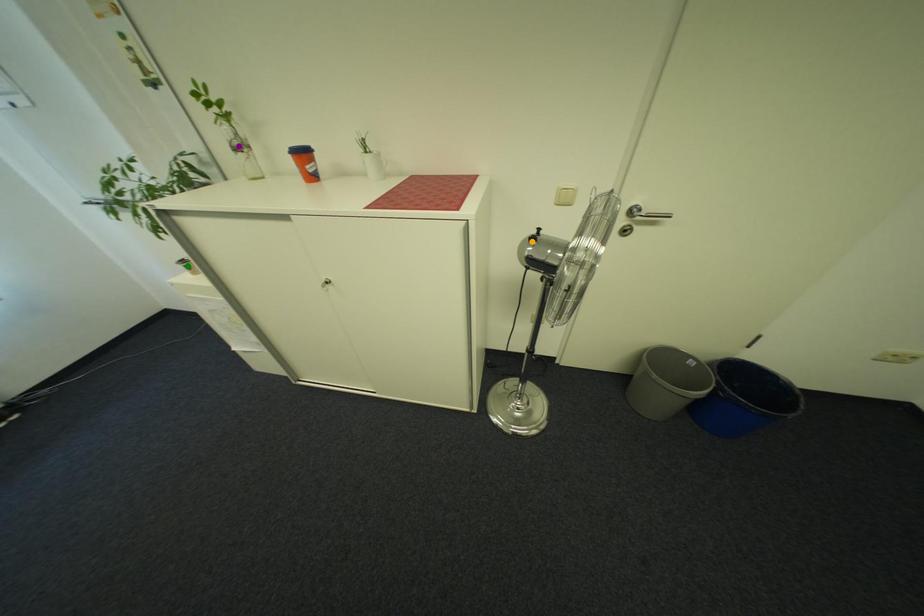
Order these from nearest to farthest:
green point | purple point | orange point

1. orange point
2. purple point
3. green point